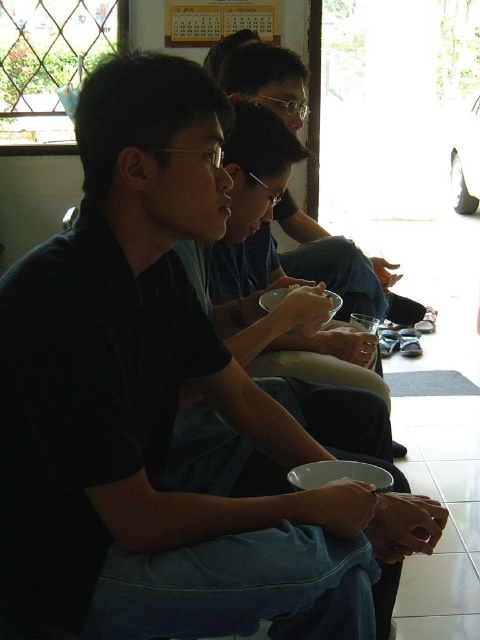
Does matte black shirt at center appear over matte black bowl at center?

Yes, matte black shirt at center is above matte black bowl at center.

Is point (299, 90) more distant than point (265, 148)?

Yes, it is behind point (265, 148).

Does point (372, 269) come farther from viewer compared to point (241, 179)?

Yes, point (372, 269) is behind point (241, 179).

Locate an element on the screen. matte black shirt at center is located at coordinates (332, 268).